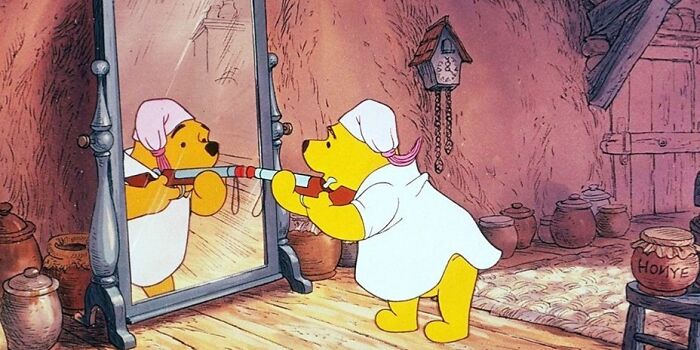
Locate an element on the screen. Image resolution: width=700 pixels, height=350 pixels. reflection of winnie the pooh in the mirror is located at coordinates (190, 143).